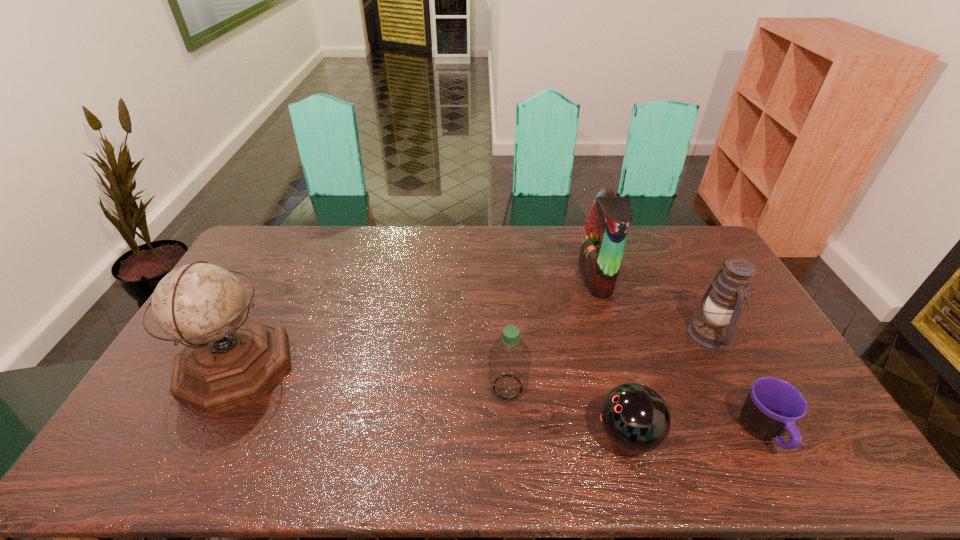
Where is `free location that satisfies the following two spatial constraints: 1. with the handle on the side of the mug; 2. on the surface of the second shortest object near the finger holes`? free location that satisfies the following two spatial constraints: 1. with the handle on the side of the mug; 2. on the surface of the second shortest object near the finger holes is located at coordinates (764, 435).

Where is `vacant point that satisfies the following two spatial constraints: 1. at the face of the farthest object; 2. on the left side of the oil lamp`? The image size is (960, 540). vacant point that satisfies the following two spatial constraints: 1. at the face of the farthest object; 2. on the left side of the oil lamp is located at coordinates (613, 336).

Locate an element on the screen. The height and width of the screenshot is (540, 960). vacant point that satisfies the following two spatial constraints: 1. at the face of the farthest object; 2. on the front side of the water bottle is located at coordinates (629, 387).

Identify the location of blank space that satisfies the following two spatial constraints: 1. on the front side of the oil lamp; 2. on the surface of the leftmost object. The image size is (960, 540). (726, 366).

The width and height of the screenshot is (960, 540). Find the location of `free space that satisfies the following two spatial constraints: 1. at the face of the oil lamp; 2. on the left side of the farthest object`. free space that satisfies the following two spatial constraints: 1. at the face of the oil lamp; 2. on the left side of the farthest object is located at coordinates (613, 336).